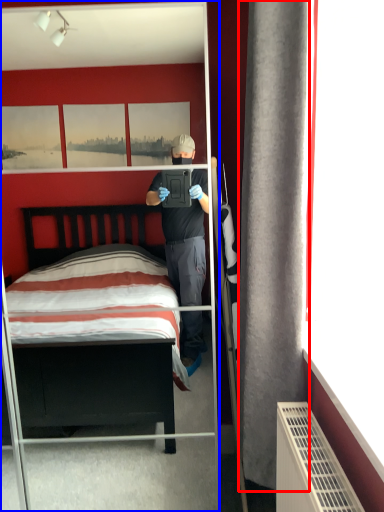
Question: Among these objects, which one is farthest to the camera, curtain (highlighted by a red box) or mirror (highlighted by a blue box)?

Choices:
 (A) curtain
 (B) mirror

Answer: (B)